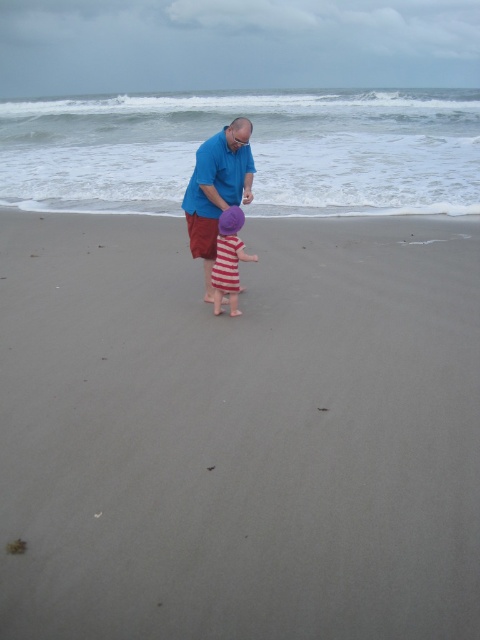
Between point (272, 614) and point (230, 204), which one is positioned in front?

Point (272, 614)

Does point (327, 477) come farther from viewer compared to point (200, 157)?

No, (327, 477) is in front of (200, 157).

Between point (364, 292) and point (199, 182), which one is positioned behind?

The point (364, 292) is behind.

This screenshot has height=640, width=480. Identify the location of smooth sand at center. (240, 432).

Who is higher up, smooth sand at center or striped fabric dress at center?

striped fabric dress at center is higher up.

The image size is (480, 640). I want to click on smooth sand at center, so click(240, 432).

Image resolution: width=480 pixels, height=640 pixels. Identify the location of smooth sand at center. (240, 432).

What are the coordinates of `smooth sand at center` in the screenshot? It's located at (240, 432).

Is point (207, 300) positioned behind point (217, 246)?

That is True.

Is blue cotton shirt at center wider than striped fabric dress at center?

Correct, the width of blue cotton shirt at center exceeds that of striped fabric dress at center.

Measure the distance between point [207,205] and camera.

Point [207,205] is 20.56 feet away from camera.

The width and height of the screenshot is (480, 640). What are the coordinates of `blue cotton shirt at center` in the screenshot? It's located at (216, 189).